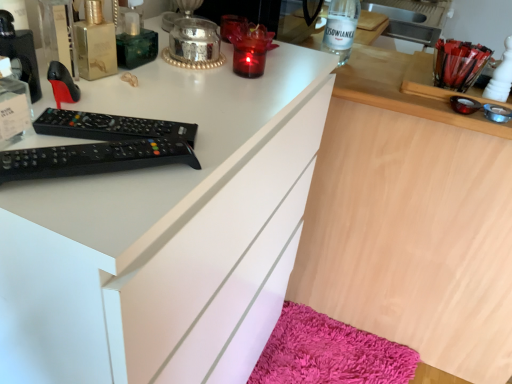
Question: Is clear glass bottle at upper center located within wooden desk at center?

Choices:
 (A) yes
 (B) no

Answer: (B)

Question: Does wooden desk at center have a lesser width compared to clear glass bottle at upper center?

Choices:
 (A) no
 (B) yes

Answer: (A)

Question: Considering the relative sizes of wooden desk at center and clear glass bottle at upper center in the image provided, is wooden desk at center smaller than clear glass bottle at upper center?

Choices:
 (A) no
 (B) yes

Answer: (A)

Question: From a real-world perspective, does wooden desk at center stand above clear glass bottle at upper center?

Choices:
 (A) yes
 (B) no

Answer: (B)

Question: Can you confirm if wooden desk at center is bigger than clear glass bottle at upper center?

Choices:
 (A) yes
 (B) no

Answer: (A)

Question: Looking at the image, does shaggy pink bath mat at lower right seem bigger or smaller compared to black plastic remote control at upper left?

Choices:
 (A) big
 (B) small

Answer: (A)

Question: From their relative heights in the image, would you say shaggy pink bath mat at lower right is taller or shorter than black plastic remote control at upper left?

Choices:
 (A) tall
 (B) short

Answer: (A)

Question: From the image's perspective, relative to black plastic remote control at upper left, is shaggy pink bath mat at lower right above or below?

Choices:
 (A) above
 (B) below

Answer: (B)

Question: Is shaggy pink bath mat at lower right spatially inside black plastic remote control at upper left, or outside of it?

Choices:
 (A) inside
 (B) outside

Answer: (B)

Question: Considering the relative positions of shaggy pink bath mat at lower right and clear glass bottle at upper center in the image provided, is shaggy pink bath mat at lower right to the left or to the right of clear glass bottle at upper center?

Choices:
 (A) right
 (B) left

Answer: (A)

Question: Considering their positions, is shaggy pink bath mat at lower right located in front of or behind clear glass bottle at upper center?

Choices:
 (A) front
 (B) behind

Answer: (B)

Question: Looking at their shapes, would you say shaggy pink bath mat at lower right is wider or thinner than clear glass bottle at upper center?

Choices:
 (A) thin
 (B) wide

Answer: (B)

Question: From the image's perspective, is shaggy pink bath mat at lower right above or below clear glass bottle at upper center?

Choices:
 (A) above
 (B) below

Answer: (B)

Question: Considering the positions of shaggy pink bath mat at lower right and wooden desk at center in the image, is shaggy pink bath mat at lower right taller or shorter than wooden desk at center?

Choices:
 (A) tall
 (B) short

Answer: (B)

Question: Is shaggy pink bath mat at lower right wider or thinner than wooden desk at center?

Choices:
 (A) thin
 (B) wide

Answer: (A)